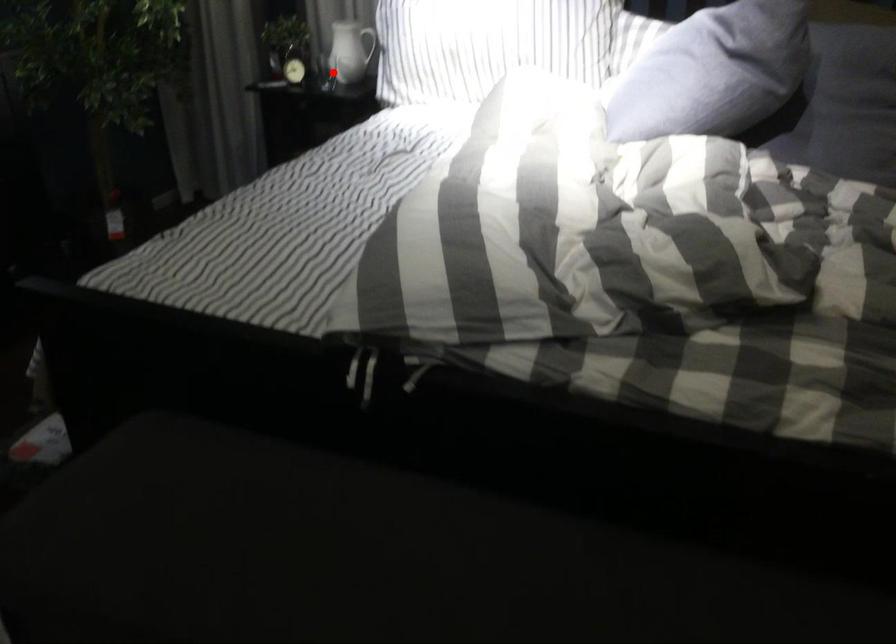
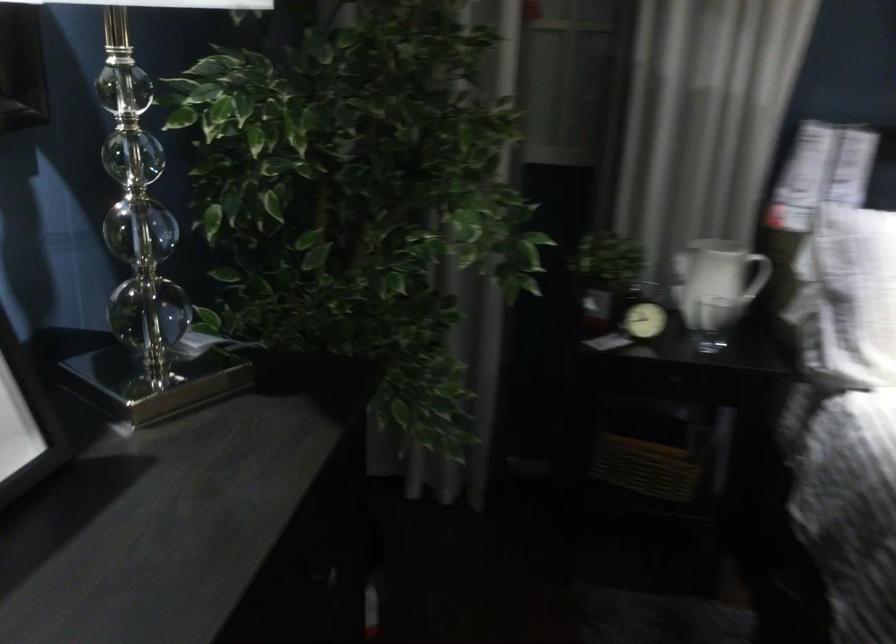
In the second image, find the point that corresponds to the highlighted location in the first image.

(713, 323)